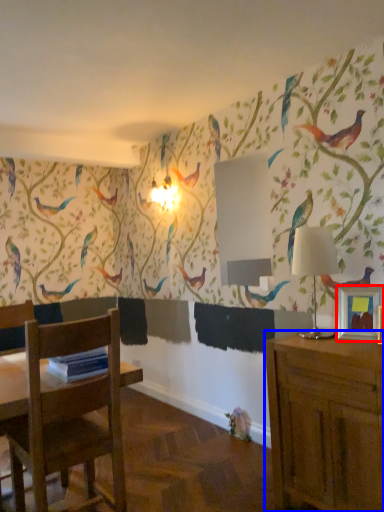
Question: Which point is closer to the camera, picture frame (highlighted by a red box) or cabinetry (highlighted by a blue box)?

Choices:
 (A) picture frame
 (B) cabinetry

Answer: (B)